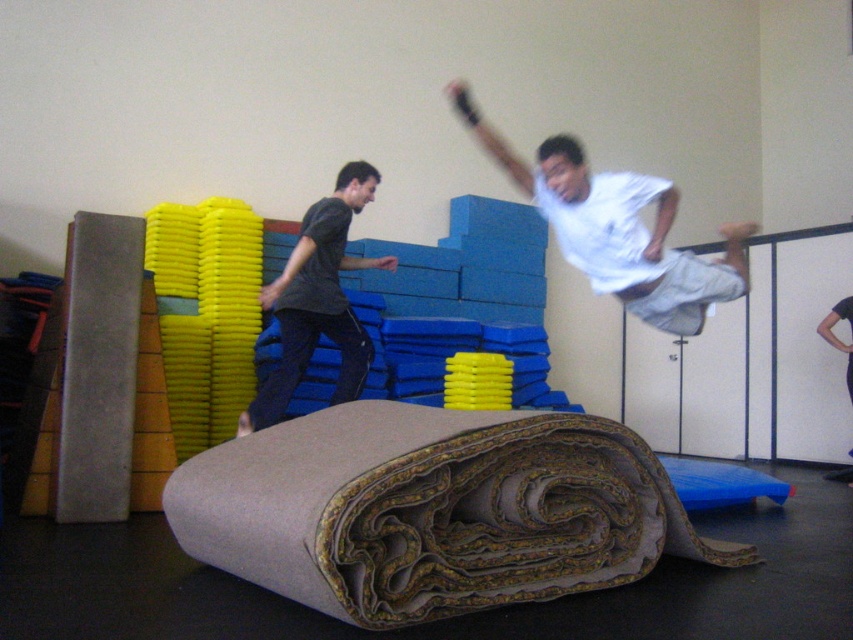
You are a photographer positioned at the camera. You notice two points in the scene, point (642, 198) and point (844, 312). Which point is nearer to your current position?

Point (642, 198) is closer to the camera than point (844, 312).

You are standing in the gymnasium and see the point marked at coordinates (618, 228). What object is located at that point?

The point at coordinates (618, 228) marks the white matte shirt at upper center.